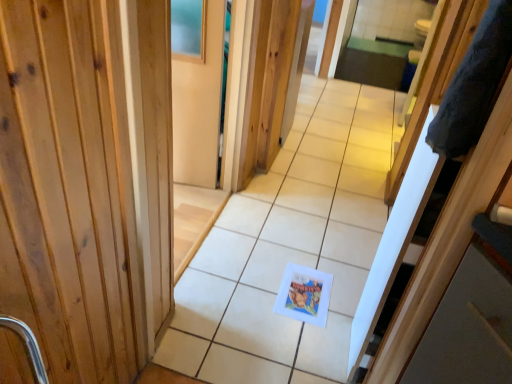
I want to click on gray fluffy robe at right, so click(x=474, y=85).

Measure the distance between point (333, 248) and camera.

A: 2.05 meters.

What is the approximate height of matte wood screen door at upper center?

38.09 inches.

At what (x,y) coordinates should I click in order to perform the action: click on wooden at center. Please return your answer as a coordinate pair (x, y). This screenshot has height=384, width=512. Looking at the image, I should click on (174, 142).

Where is `gray fluffy robe at right`? The height and width of the screenshot is (384, 512). gray fluffy robe at right is located at coordinates (474, 85).

Considering the positions of objects matte wood screen door at upper center and gray fluffy robe at right in the image provided, who is in front, matte wood screen door at upper center or gray fluffy robe at right?

gray fluffy robe at right is more forward.

Is matte wood screen door at upper center facing away from gray fluffy robe at right?

No, matte wood screen door at upper center is not facing the opposite direction of gray fluffy robe at right.

Is matte wood screen door at upper center directly adjacent to gray fluffy robe at right?

No, matte wood screen door at upper center is not touching gray fluffy robe at right.

Does point (471, 43) appear closer or farther from the camera than point (204, 178)?

Point (471, 43) is positioned closer to the camera compared to point (204, 178).

Is gray fluffy robe at right aimed at wooden at center?

Yes, gray fluffy robe at right is aimed at wooden at center.

Can you confirm if gray fluffy robe at right is taller than wooden at center?

Incorrect, the height of gray fluffy robe at right is not larger of that of wooden at center.

The height and width of the screenshot is (384, 512). Identify the location of robe located below the wooden at center (from the image's perspective). (474, 85).

Does wooden at center have a lesser height compared to white matte postcard at center?

No.

At what (x,y) coordinates should I click in order to perform the action: click on postcard located behind the wooden at center. Please return your answer as a coordinate pair (x, y). Looking at the image, I should click on (304, 294).

Does wooden at center turn towards white matte postcard at center?

Yes, wooden at center is turned towards white matte postcard at center.

Can white matte postcard at center be found inside wooden at center?

No, white matte postcard at center is not a part of wooden at center.

From a real-world perspective, between wooden at center and gray fluffy robe at right, who is vertically lower?

wooden at center, from a real-world perspective.

Does wooden at center lie behind gray fluffy robe at right?

Yes, the depth of wooden at center is greater than that of gray fluffy robe at right.

Does wooden at center turn towards gray fluffy robe at right?

Yes, wooden at center is aimed at gray fluffy robe at right.

Locate an element on the screen. The image size is (512, 384). robe lying in front of the wooden at center is located at coordinates (474, 85).

Considering the relative sizes of white matte postcard at center and matte wood screen door at upper center in the image provided, is white matte postcard at center thinner than matte wood screen door at upper center?

Incorrect, the width of white matte postcard at center is not less than that of matte wood screen door at upper center.

Between white matte postcard at center and matte wood screen door at upper center, which one appears on the left side from the viewer's perspective?

matte wood screen door at upper center is more to the left.

Identify the location of postcard directly beneath the matte wood screen door at upper center (from a real-world perspective). This screenshot has height=384, width=512. (304, 294).

From the image's perspective, which is below, white matte postcard at center or matte wood screen door at upper center?

white matte postcard at center, from the image's perspective.

Based on their positions, is white matte postcard at center located to the left or right of wooden at center?

From the image, it's evident that white matte postcard at center is to the right of wooden at center.

Considering the positions of point (290, 286) and point (140, 13), is point (290, 286) closer or farther from the camera than point (140, 13)?

Point (290, 286).

Is white matte postcard at center aimed at wooden at center?

No, white matte postcard at center is not facing towards wooden at center.

Looking at this image, is white matte postcard at center wider than wooden at center?

Correct, the width of white matte postcard at center exceeds that of wooden at center.

Is white paper at center surrounded by matte wood screen door at upper center?

No.

Which is closer, (x=201, y=18) or (x=342, y=99)?

The point (x=201, y=18) is in front.

Which object is more forward, matte wood screen door at upper center or white paper at center?

white paper at center is closer to the camera.

The image size is (512, 384). I want to click on screen door on the left side of gray fluffy robe at right, so click(x=197, y=89).

Where is `robe that is above the wooden at center (from a real-world perspective)`? robe that is above the wooden at center (from a real-world perspective) is located at coordinates (474, 85).

Considering their positions, is matte wood screen door at upper center positioned closer to wooden at center than white paper at center?

matte wood screen door at upper center is positioned closer to the anchor wooden at center.

When comparing their distances from wooden at center, does gray fluffy robe at right or white paper at center seem further?

The object further to wooden at center is gray fluffy robe at right.

Estimate the real-world distances between objects in this image. Which object is closer to gray fluffy robe at right, white matte postcard at center or wooden at center?

Among the two, wooden at center is located nearer to gray fluffy robe at right.

Looking at the image, which one is located further to gray fluffy robe at right, matte wood screen door at upper center or white matte postcard at center?

matte wood screen door at upper center.

Consider the image. Looking at the image, which one is located closer to wooden at center, white paper at center or white matte postcard at center?

white paper at center is closer to wooden at center.

When comparing their distances from white paper at center, does matte wood screen door at upper center or white matte postcard at center seem further?

Among the two, matte wood screen door at upper center is located further to white paper at center.

When comparing their distances from white matte postcard at center, does wooden at center or white paper at center seem closer?

white paper at center.

Which object lies nearer to the anchor point matte wood screen door at upper center, gray fluffy robe at right or wooden at center?

The object closer to matte wood screen door at upper center is wooden at center.

Where is `barn door between white paper at center and matte wood screen door at upper center from front to back`? barn door between white paper at center and matte wood screen door at upper center from front to back is located at coordinates coord(174,142).

The height and width of the screenshot is (384, 512). In order to click on barn door positioned between white paper at center and white matte postcard at center from near to far in this screenshot , I will do `click(174, 142)`.

I want to click on robe located between white paper at center and matte wood screen door at upper center in the depth direction, so click(474, 85).

I want to click on postcard located between gray fluffy robe at right and matte wood screen door at upper center in the depth direction, so click(x=304, y=294).